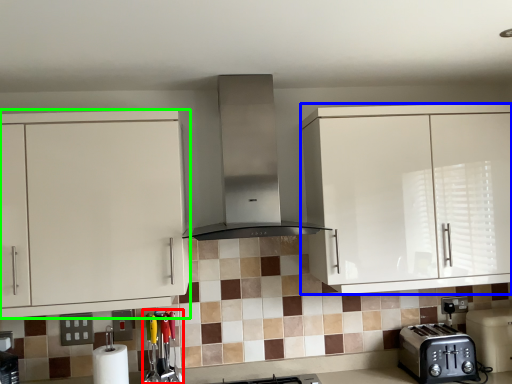
Question: Which object is the closest to the appliance (highlighted by a red box)? Choose among these: cabinetry (highlighted by a blue box) or cabinetry (highlighted by a green box).

Choices:
 (A) cabinetry
 (B) cabinetry

Answer: (B)